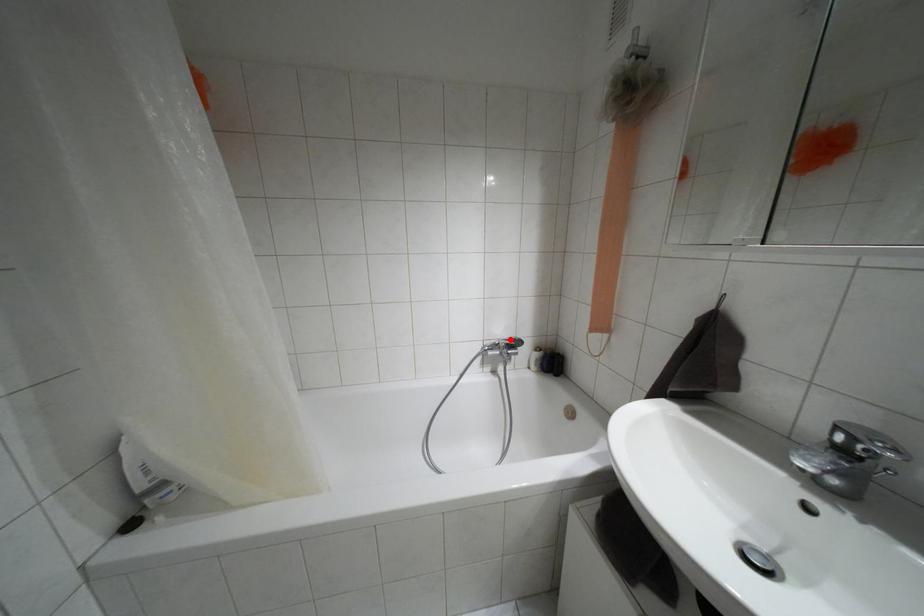
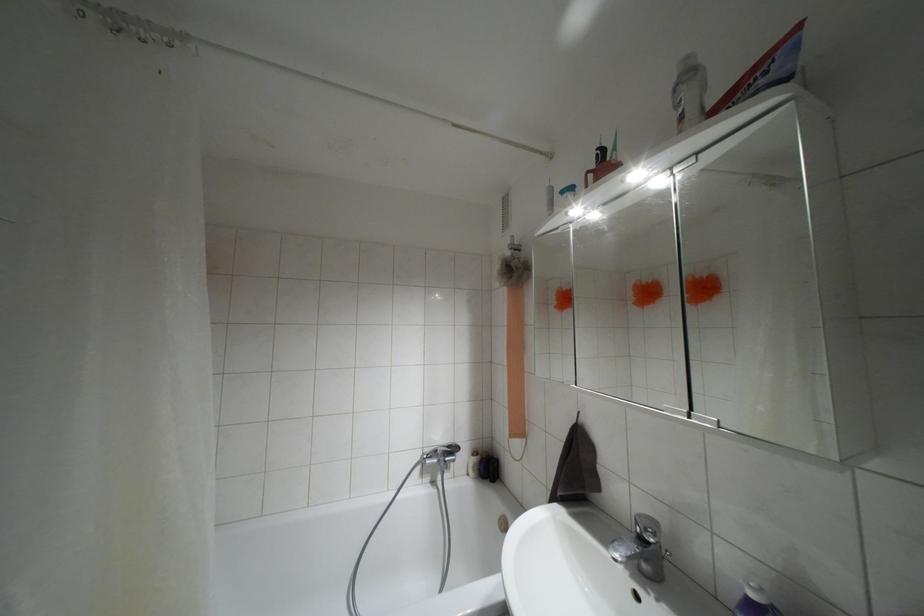
Locate, in the second image, the point that corresponds to the highlighted location in the first image.

(447, 446)